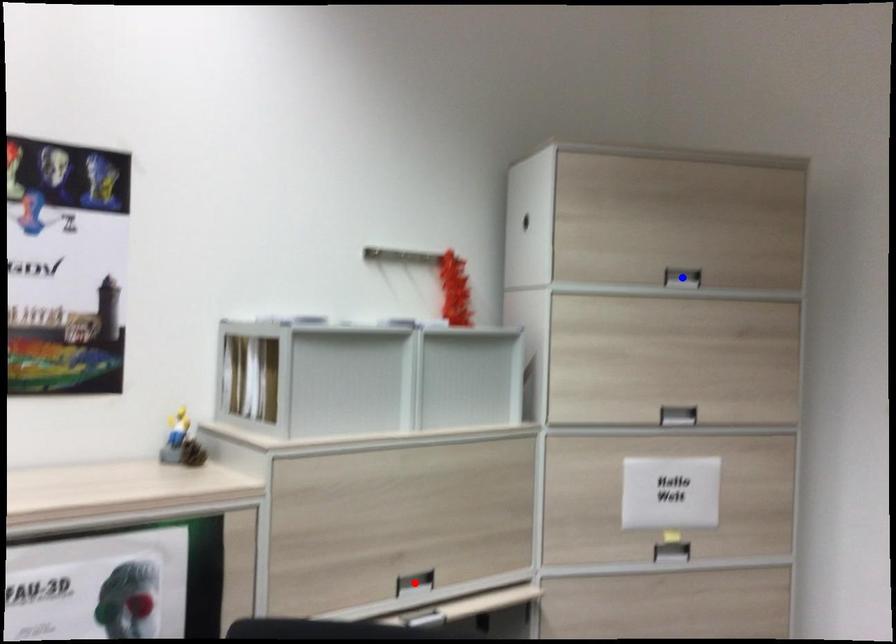
Question: Which of the two points in the image is closer to the camera?

Choices:
 (A) Blue point is closer.
 (B) Red point is closer.

Answer: (B)